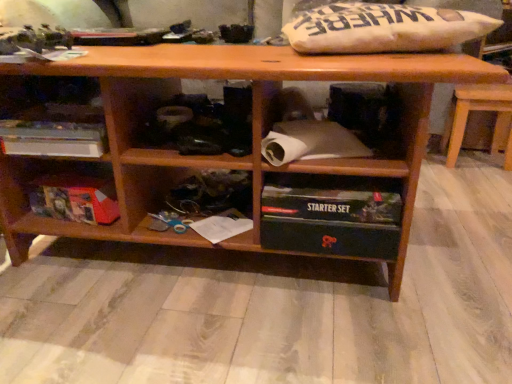
Question: Is matte cardboard box at lower left, acting as the 3th shelf starting from the right, aimed at black plastic starter set at lower center, which ranks as the 3th shelf in left-to-right order?

Choices:
 (A) yes
 (B) no

Answer: (B)

Question: Considering the relative sizes of matte cardboard box at lower left, acting as the 3th shelf starting from the right, and black plastic starter set at lower center, which ranks as the 3th shelf in left-to-right order, in the image provided, is matte cardboard box at lower left, acting as the 3th shelf starting from the right, wider than black plastic starter set at lower center, which ranks as the 3th shelf in left-to-right order,?

Choices:
 (A) no
 (B) yes

Answer: (A)

Question: From a real-world perspective, is matte cardboard box at lower left, positioned as the 1th shelf in left-to-right order, positioned over black plastic starter set at lower center, which ranks as the 3th shelf in left-to-right order, based on gravity?

Choices:
 (A) yes
 (B) no

Answer: (B)

Question: Is matte cardboard box at lower left, acting as the 3th shelf starting from the right, taller than black plastic starter set at lower center, which ranks as the 3th shelf in left-to-right order?

Choices:
 (A) yes
 (B) no

Answer: (B)

Question: From a real-world perspective, is matte cardboard box at lower left, positioned as the 1th shelf in left-to-right order, positioned under black plastic starter set at lower center, which ranks as the 3th shelf in left-to-right order, based on gravity?

Choices:
 (A) no
 (B) yes

Answer: (B)

Question: From the image's perspective, would you say matte cardboard box at lower left, positioned as the 1th shelf in left-to-right order, is positioned over black plastic starter set at lower center, which ranks as the 3th shelf in left-to-right order?

Choices:
 (A) no
 (B) yes

Answer: (B)

Question: Is the position of white paper at lower center less distant than that of matte cardboard box at lower left, positioned as the 1th shelf in left-to-right order?

Choices:
 (A) no
 (B) yes

Answer: (B)

Question: Does white paper at lower center have a lesser height compared to matte cardboard box at lower left, positioned as the 1th shelf in left-to-right order?

Choices:
 (A) yes
 (B) no

Answer: (A)

Question: From the image's perspective, is white paper at lower center on top of matte cardboard box at lower left, acting as the 3th shelf starting from the right?

Choices:
 (A) no
 (B) yes

Answer: (A)

Question: Is white paper at lower center at the right side of matte cardboard box at lower left, positioned as the 1th shelf in left-to-right order?

Choices:
 (A) yes
 (B) no

Answer: (A)

Question: From the image's perspective, does white paper at lower center appear lower than matte cardboard box at lower left, positioned as the 1th shelf in left-to-right order?

Choices:
 (A) yes
 (B) no

Answer: (A)

Question: Is white paper at lower center oriented towards matte cardboard box at lower left, acting as the 3th shelf starting from the right?

Choices:
 (A) no
 (B) yes

Answer: (A)

Question: Is the depth of white cardboard box at left, placed as the second shelf when sorted from right to left, greater than that of black plastic starter set at lower center, which ranks as the 3th shelf in left-to-right order?

Choices:
 (A) yes
 (B) no

Answer: (A)